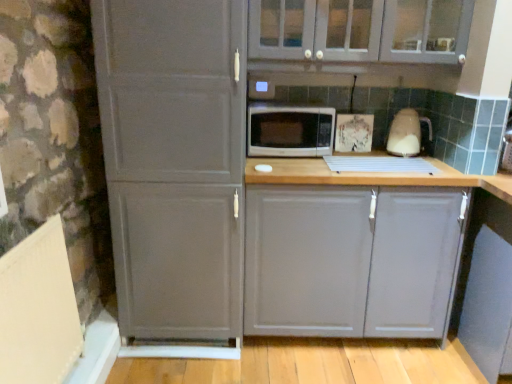
Question: From a real-world perspective, is white glossy kettle at right positioned over white glossy microwave at center based on gravity?

Choices:
 (A) no
 (B) yes

Answer: (B)

Question: Can you confirm if white glossy kettle at right is shorter than white glossy microwave at center?

Choices:
 (A) yes
 (B) no

Answer: (B)

Question: Is white glossy kettle at right positioned far away from white glossy microwave at center?

Choices:
 (A) no
 (B) yes

Answer: (A)

Question: Considering the relative positions of white glossy kettle at right and white glossy microwave at center in the image provided, is white glossy kettle at right to the left of white glossy microwave at center from the viewer's perspective?

Choices:
 (A) no
 (B) yes

Answer: (A)

Question: Is white glossy kettle at right smaller than white glossy microwave at center?

Choices:
 (A) yes
 (B) no

Answer: (A)

Question: Considering the positions of white glossy kettle at right and matte gray cabinet at center, which is the 2th cabinetry from top to bottom, in the image, is white glossy kettle at right taller or shorter than matte gray cabinet at center, which is the 2th cabinetry from top to bottom,?

Choices:
 (A) short
 (B) tall

Answer: (A)

Question: Which is correct: white glossy kettle at right is inside matte gray cabinet at center, which is the 2th cabinetry from top to bottom, or outside of it?

Choices:
 (A) outside
 (B) inside

Answer: (A)

Question: Relative to matte gray cabinet at center, which is the 2th cabinetry from top to bottom, is white glossy kettle at right in front or behind?

Choices:
 (A) front
 (B) behind

Answer: (B)

Question: From the image's perspective, is white glossy kettle at right above or below matte gray cabinet at center, the 1th cabinetry positioned from the bottom?

Choices:
 (A) above
 (B) below

Answer: (A)

Question: From the image's perspective, relative to matte gray cabinet at center, which is the 2th cabinetry from top to bottom, is matte gray cabinet at upper center, acting as the first cabinetry starting from the top, above or below?

Choices:
 (A) below
 (B) above

Answer: (B)

Question: Which is correct: matte gray cabinet at upper center, acting as the first cabinetry starting from the top, is inside matte gray cabinet at center, the 1th cabinetry positioned from the bottom, or outside of it?

Choices:
 (A) inside
 (B) outside

Answer: (B)

Question: Does point (266, 6) appear closer or farther from the camera than point (378, 307)?

Choices:
 (A) farther
 (B) closer

Answer: (B)

Question: Based on their positions, is matte gray cabinet at upper center, acting as the first cabinetry starting from the top, located to the left or right of matte gray cabinet at center, the 1th cabinetry positioned from the bottom?

Choices:
 (A) right
 (B) left

Answer: (B)

Question: From the image's perspective, is matte gray cabinet at center, the 1th cabinetry positioned from the bottom, positioned above or below white glossy microwave at center?

Choices:
 (A) below
 (B) above

Answer: (A)

Question: In terms of width, does matte gray cabinet at center, the 1th cabinetry positioned from the bottom, look wider or thinner when compared to white glossy microwave at center?

Choices:
 (A) wide
 (B) thin

Answer: (A)